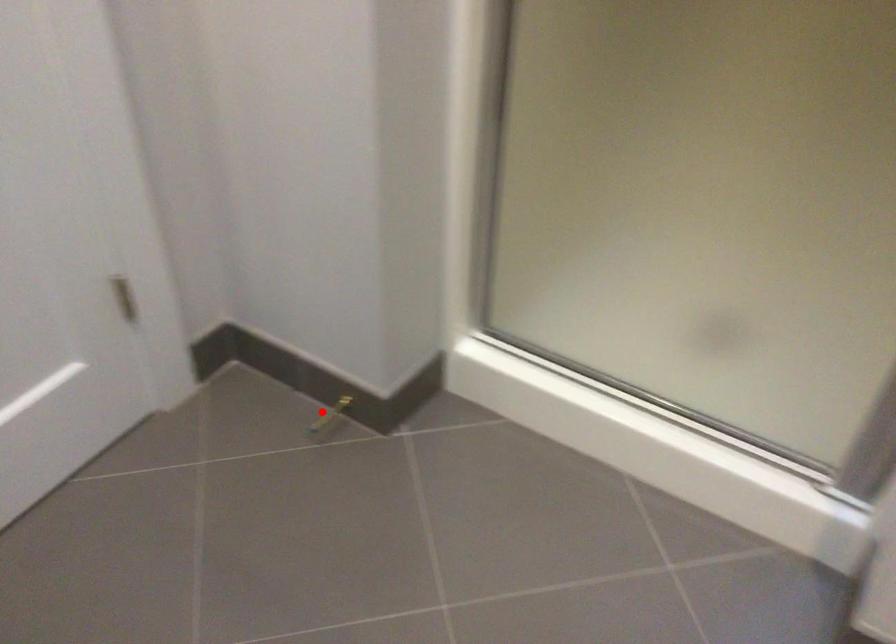
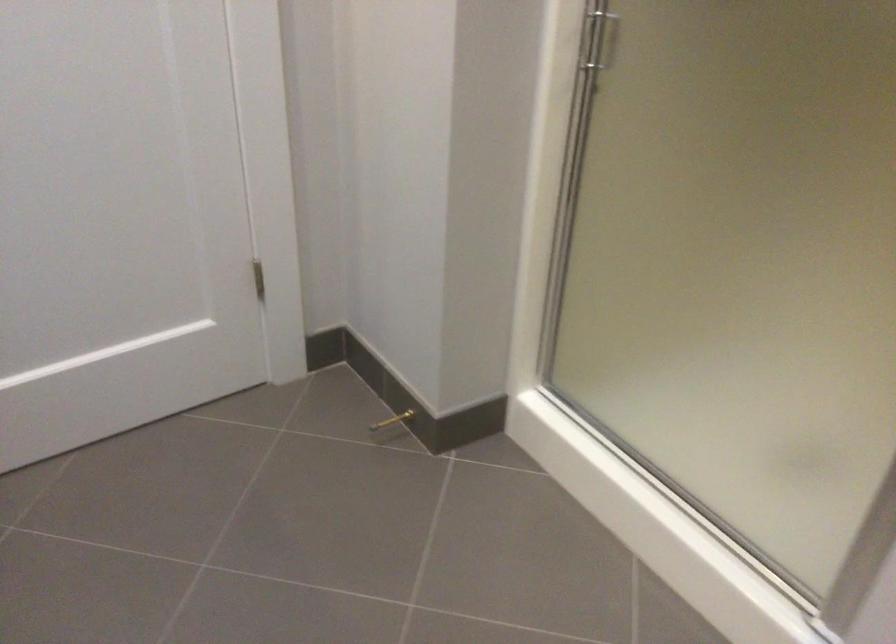
Question: I am providing you with two images of the same scene from different viewpoints. Given a red point in image1, look at the same physical point in image2. Is it:

Choices:
 (A) Closer to the viewpoint
 (B) Farther from the viewpoint

Answer: (B)